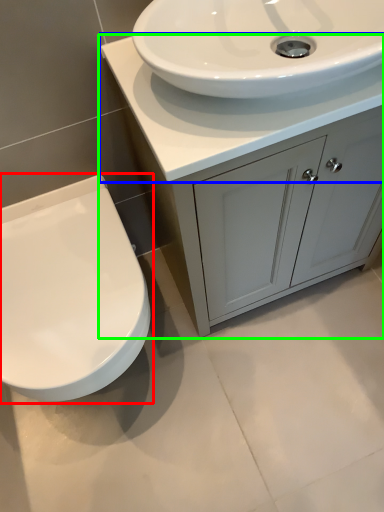
Question: Which is farther away from toilet (highlighted by a red box)? counter top (highlighted by a blue box) or bathroom cabinet (highlighted by a green box)?

Choices:
 (A) counter top
 (B) bathroom cabinet

Answer: (A)